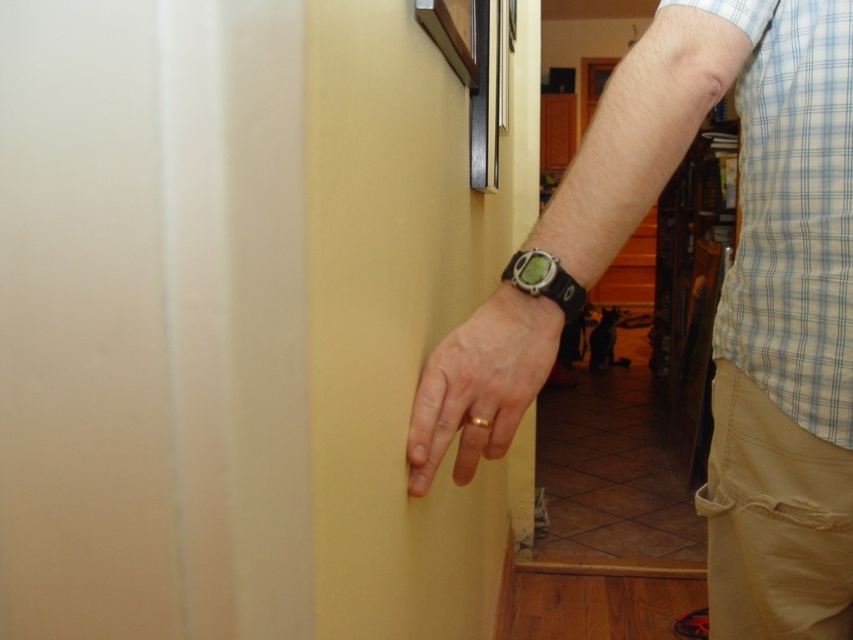
Which is behind, point (369, 365) or point (490, 300)?

The point (490, 300) is more distant.

Which is in front, point (383, 328) or point (538, 355)?

Point (383, 328)

Locate an element on the screen. The height and width of the screenshot is (640, 853). yellow matte door at center is located at coordinates (403, 316).

Consider the image. Who is shorter, matte black watch at upper right or black rubber watch at center?

black rubber watch at center is shorter.

Can you confirm if matte black watch at upper right is smaller than black rubber watch at center?

Actually, matte black watch at upper right might be larger than black rubber watch at center.

This screenshot has height=640, width=853. Find the location of `matte black watch at upper right`. matte black watch at upper right is located at coordinates (749, 285).

Find the location of a particular element. The height and width of the screenshot is (640, 853). matte black watch at upper right is located at coordinates click(749, 285).

Does matte black watch at upper right appear on the left side of khaki cotton pants at lower right?

Indeed, matte black watch at upper right is positioned on the left side of khaki cotton pants at lower right.

Between matte black watch at upper right and khaki cotton pants at lower right, which one appears on the left side from the viewer's perspective?

From the viewer's perspective, matte black watch at upper right appears more on the left side.

Between point (759, 486) and point (805, 592), which one is positioned in front?

Point (759, 486) is more forward.

Where is `matte black watch at upper right`? Image resolution: width=853 pixels, height=640 pixels. matte black watch at upper right is located at coordinates (749, 285).